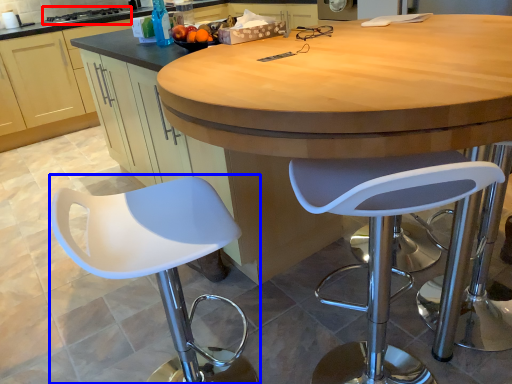
Question: Which point is closer to the camera, stove (highlighted by a red box) or chair (highlighted by a blue box)?

Choices:
 (A) stove
 (B) chair

Answer: (B)